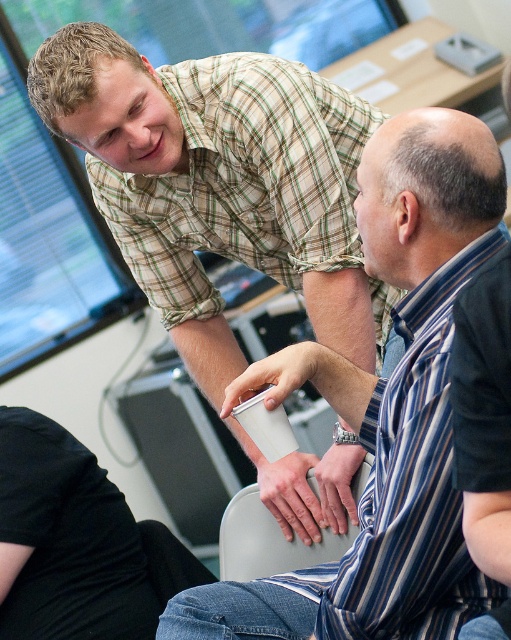
Question: Which point is farther to the camera?

Choices:
 (A) gray plastic chair at lower center
 (B) black fabric shirt at lower left
 (C) green plaid shirt at upper center

Answer: (B)

Question: Which point is farther to the camera?

Choices:
 (A) matte plaid shirt at upper left
 (B) black fabric shirt at lower left

Answer: (B)

Question: Is matte plaid shirt at upper left further to camera compared to green plaid shirt at upper center?

Choices:
 (A) no
 (B) yes

Answer: (B)

Question: Is black fabric shirt at lower left bigger than gray plastic chair at lower center?

Choices:
 (A) no
 (B) yes

Answer: (B)

Question: Which object is closer to the camera taking this photo?

Choices:
 (A) matte plaid shirt at upper left
 (B) black fabric shirt at lower left

Answer: (A)

Question: From the image, what is the correct spatial relationship of matte plaid shirt at upper left in relation to black fabric shirt at lower left?

Choices:
 (A) above
 (B) below

Answer: (A)